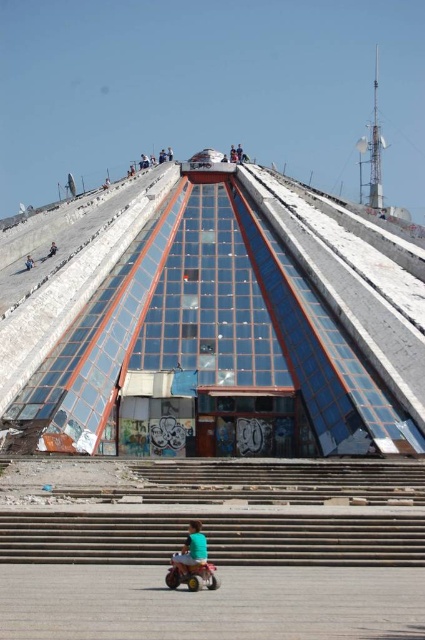
Is transparent glass pyramid at upper center in front of concrete stairs at lower center?

No.

Between transparent glass pyramid at upper center and concrete stairs at lower center, which one appears on the left side from the viewer's perspective?

Positioned to the left is concrete stairs at lower center.

What do you see at coordinates (218, 333) in the screenshot? This screenshot has width=425, height=640. I see `transparent glass pyramid at upper center` at bounding box center [218, 333].

Where is `transparent glass pyramid at upper center`? The width and height of the screenshot is (425, 640). transparent glass pyramid at upper center is located at coordinates (218, 333).

This screenshot has width=425, height=640. Describe the element at coordinates (192, 550) in the screenshot. I see `green fabric shirt at lower center` at that location.

Between green fabric shirt at lower center and dark blue fabric at upper center, which one is positioned higher?

dark blue fabric at upper center

I want to click on green fabric shirt at lower center, so click(192, 550).

Find the location of a particular element. This screenshot has width=425, height=640. transparent glass pyramid at upper center is located at coordinates (218, 333).

Is point (158, 266) positioned behind point (193, 552)?

Yes, it is.

Which is in front, point (170, 392) or point (181, 556)?

Point (181, 556) is in front.

Where is `transparent glass pyramid at upper center`? The width and height of the screenshot is (425, 640). transparent glass pyramid at upper center is located at coordinates (218, 333).